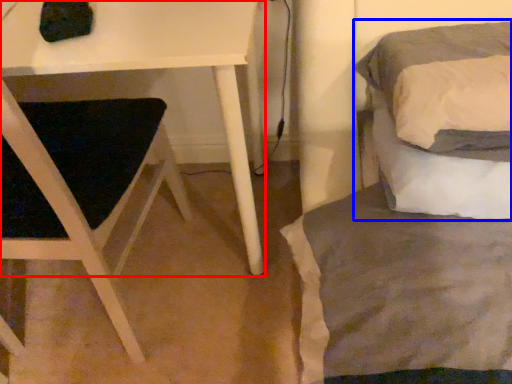
Question: Among these objects, which one is nearest to the camera, table (highlighted by a red box) or bed (highlighted by a blue box)?

Choices:
 (A) table
 (B) bed

Answer: (B)